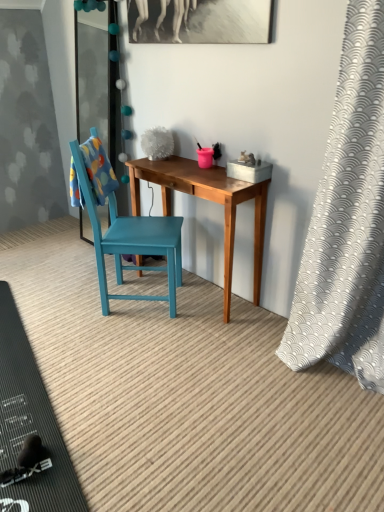
Question: Can you confirm if wooden desk at center is positioned to the left of black rubber mat at lower left?

Choices:
 (A) no
 (B) yes

Answer: (A)

Question: From a real-world perspective, is wooden desk at center beneath black rubber mat at lower left?

Choices:
 (A) no
 (B) yes

Answer: (A)

Question: Considering the relative sizes of wooden desk at center and black rubber mat at lower left in the image provided, is wooden desk at center taller than black rubber mat at lower left?

Choices:
 (A) no
 (B) yes

Answer: (B)

Question: Is black rubber mat at lower left a part of wooden desk at center?

Choices:
 (A) yes
 (B) no

Answer: (B)

Question: Does wooden desk at center lie in front of black rubber mat at lower left?

Choices:
 (A) no
 (B) yes

Answer: (A)

Question: Does wooden desk at center have a larger size compared to black rubber mat at lower left?

Choices:
 (A) yes
 (B) no

Answer: (A)

Question: Does teal wooden chair at center appear on the left side of wooden desk at center?

Choices:
 (A) yes
 (B) no

Answer: (A)

Question: Does teal wooden chair at center have a lesser height compared to wooden desk at center?

Choices:
 (A) yes
 (B) no

Answer: (B)

Question: Is the position of teal wooden chair at center more distant than that of wooden desk at center?

Choices:
 (A) no
 (B) yes

Answer: (A)

Question: From the image's perspective, is teal wooden chair at center above wooden desk at center?

Choices:
 (A) yes
 (B) no

Answer: (A)

Question: Is the surface of teal wooden chair at center in direct contact with wooden desk at center?

Choices:
 (A) no
 (B) yes

Answer: (A)

Question: Does teal wooden chair at center have a smaller size compared to wooden desk at center?

Choices:
 (A) no
 (B) yes

Answer: (A)

Question: From a real-world perspective, is wooden desk at center beneath teal wooden chair at center?

Choices:
 (A) yes
 (B) no

Answer: (A)